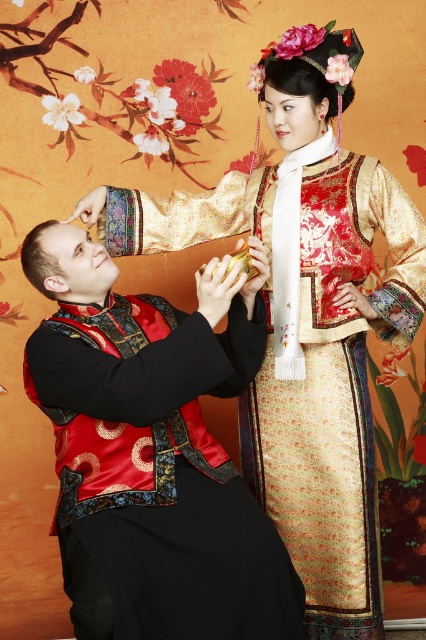
Is satin black vest at center bigger than shiny gold brocade dress at center?

Yes, satin black vest at center is bigger than shiny gold brocade dress at center.

Is point (152, 493) behind point (302, 172)?

No, it is not.

The width and height of the screenshot is (426, 640). What do you see at coordinates (152, 451) in the screenshot? I see `satin black vest at center` at bounding box center [152, 451].

Find the location of a particular element. The image size is (426, 640). satin black vest at center is located at coordinates (152, 451).